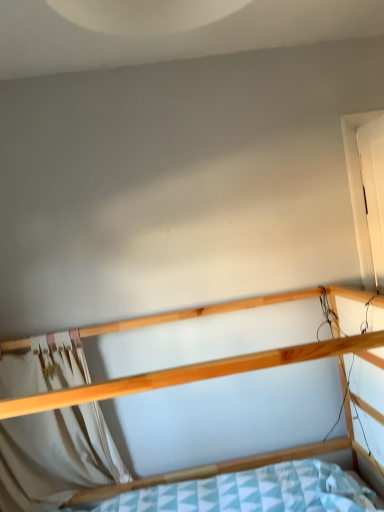
Question: Considering the relative sizes of natural wood bed at center and white fabric curtain at lower left in the image provided, is natural wood bed at center wider than white fabric curtain at lower left?

Choices:
 (A) no
 (B) yes

Answer: (B)

Question: Is natural wood bed at center facing towards white fabric curtain at lower left?

Choices:
 (A) no
 (B) yes

Answer: (A)

Question: From the image's perspective, is natural wood bed at center under white fabric curtain at lower left?

Choices:
 (A) yes
 (B) no

Answer: (A)

Question: Is white fabric curtain at lower left a part of natural wood bed at center?

Choices:
 (A) no
 (B) yes

Answer: (B)

Question: From a real-world perspective, is natural wood bed at center on top of white fabric curtain at lower left?

Choices:
 (A) yes
 (B) no

Answer: (B)

Question: Does natural wood bed at center have a greater height compared to white fabric curtain at lower left?

Choices:
 (A) no
 (B) yes

Answer: (B)

Question: Would you consider white fabric curtain at lower left to be distant from natural wood bed at center?

Choices:
 (A) yes
 (B) no

Answer: (B)

Question: From a real-world perspective, does white fabric curtain at lower left sit lower than natural wood bed at center?

Choices:
 (A) no
 (B) yes

Answer: (A)

Question: Is white fabric curtain at lower left smaller than natural wood bed at center?

Choices:
 (A) no
 (B) yes

Answer: (B)

Question: Could you tell me if white fabric curtain at lower left is facing natural wood bed at center?

Choices:
 (A) no
 (B) yes

Answer: (B)

Question: Is natural wood bed at center at the back of white fabric curtain at lower left?

Choices:
 (A) no
 (B) yes

Answer: (B)

Question: Considering the relative sizes of white fabric curtain at lower left and natural wood bed at center in the image provided, is white fabric curtain at lower left thinner than natural wood bed at center?

Choices:
 (A) no
 (B) yes

Answer: (B)

Question: Is white fabric curtain at lower left placed right next to white matte door at right?

Choices:
 (A) no
 (B) yes

Answer: (A)